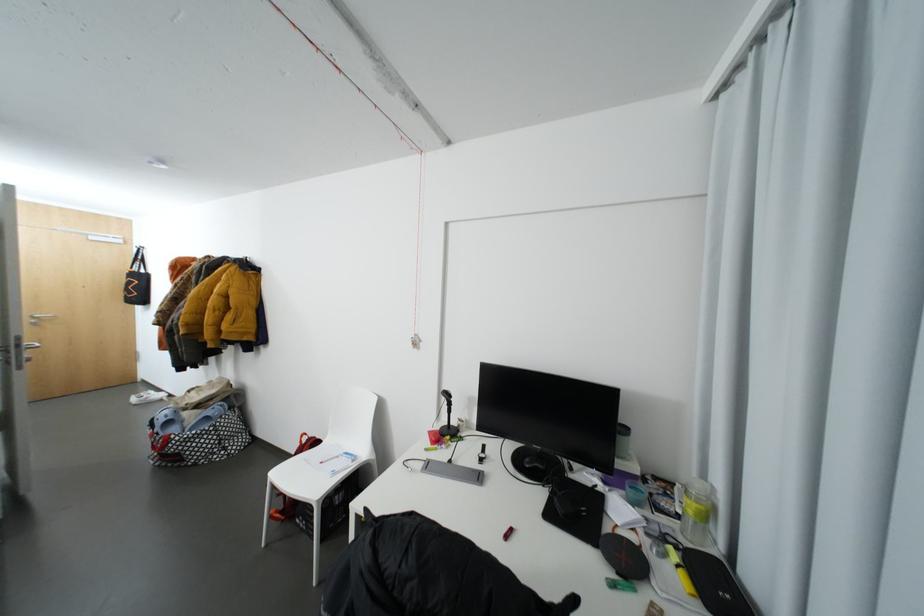
Where would you lift the grey computer keyboard? Please return your answer as a coordinate pair (x, y).

(453, 471)